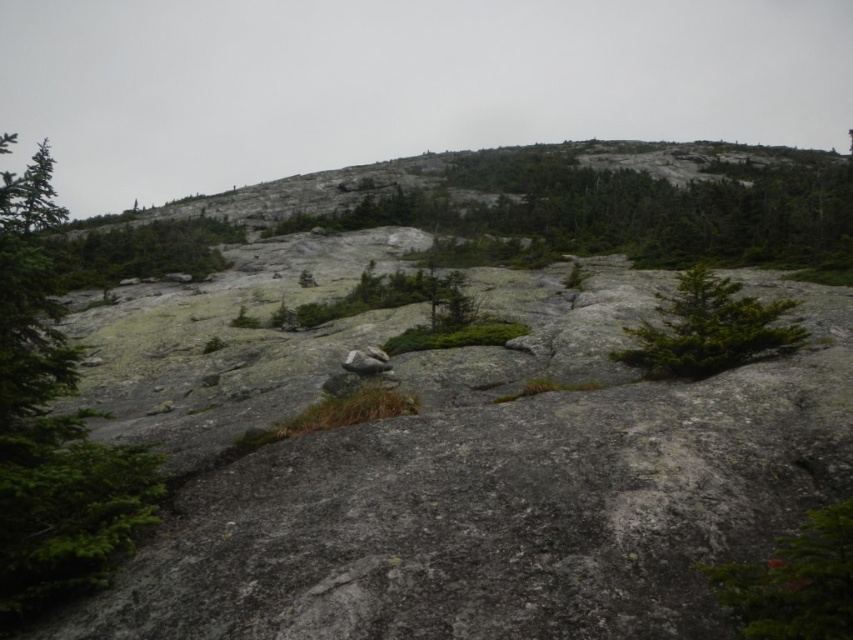
Can you confirm if green matte tree at left is thinner than green textured shrub at upper left?

Indeed, green matte tree at left has a lesser width compared to green textured shrub at upper left.

Is green matte tree at left bigger than green textured shrub at upper left?

A: Incorrect, green matte tree at left is not larger than green textured shrub at upper left.

Is point (3, 588) farther from camera compared to point (206, 228)?

No.

This screenshot has width=853, height=640. In order to click on green matte tree at left in this screenshot , I will do `click(51, 435)`.

Consider the image. Is green matte tree at center-right bigger than green textured shrub at upper left?

No.

From the picture: Who is positioned more to the right, green matte tree at center-right or green textured shrub at upper left?

Positioned to the right is green matte tree at center-right.

Does point (663, 344) come farther from viewer compared to point (80, 275)?

No, (663, 344) is in front of (80, 275).

The width and height of the screenshot is (853, 640). In order to click on green matte tree at center-right in this screenshot , I will do `click(708, 328)`.

Is point (773, 612) positioned before point (729, 362)?

Yes, point (773, 612) is closer to viewer.

Between green matte tree at lower right and green matte tree at center-right, which one has more height?

Standing taller between the two is green matte tree at center-right.

What do you see at coordinates (793, 582) in the screenshot?
I see `green matte tree at lower right` at bounding box center [793, 582].

What are the coordinates of `green matte tree at lower right` in the screenshot? It's located at (793, 582).